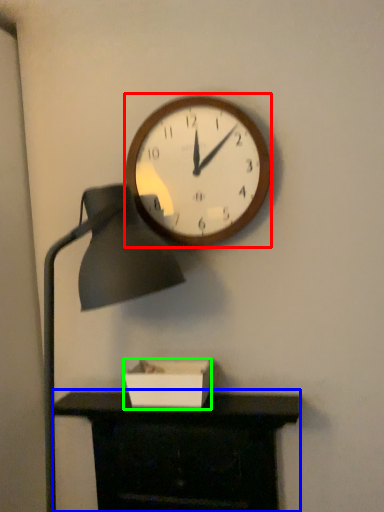
Question: Based on their relative distances, which object is nearer to wall clock (highlighted by a red box)? Choose from furniture (highlighted by a blue box) and box (highlighted by a green box).

Choices:
 (A) furniture
 (B) box

Answer: (B)